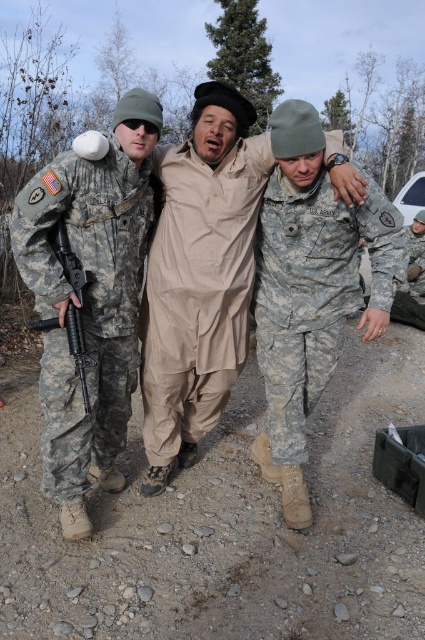
Is camouflage fabric uniform at left shorter than matte black rifle at left?

Incorrect, camouflage fabric uniform at left's height does not fall short of matte black rifle at left's.

Who is higher up, camouflage fabric uniform at left or matte black rifle at left?

camouflage fabric uniform at left is above.

I want to click on camouflage fabric uniform at left, so click(85, 301).

Can you confirm if camouflage fabric uniform at left is wider than camouflage fabric uniform at center?

No, camouflage fabric uniform at left is not wider than camouflage fabric uniform at center.

Is point (59, 372) closer to camera compared to point (305, 253)?

Yes, it is.

The height and width of the screenshot is (640, 425). Find the location of `camouflage fabric uniform at left`. camouflage fabric uniform at left is located at coordinates coord(85,301).

Who is more distant from viewer, (323, 310) or (82, 337)?

The point (323, 310) is more distant.

Is camouflage fabric uniform at center above matte black rifle at left?

Yes, camouflage fabric uniform at center is above matte black rifle at left.

The image size is (425, 640). In order to click on camouflage fabric uniform at center in this screenshot , I will do `click(314, 292)`.